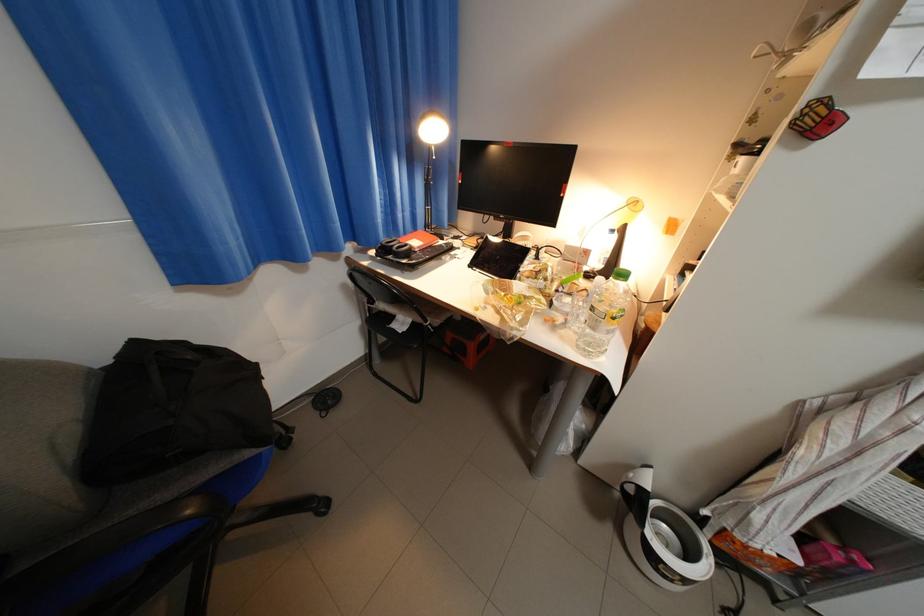
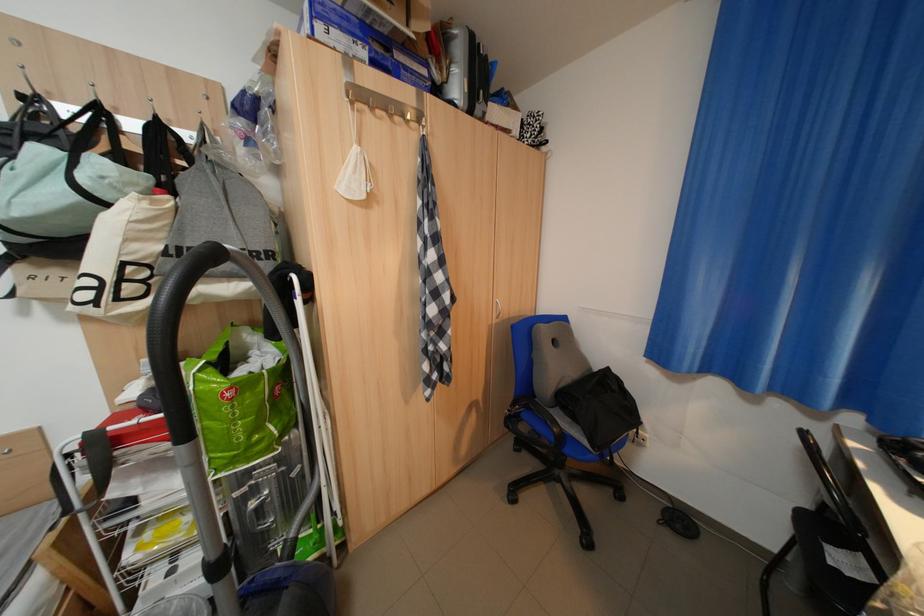
Question: The images are taken continuously from a first-person perspective. In which direction is your viewpoint rotating?

Choices:
 (A) Left
 (B) Right
 (C) Up
 (D) Down

Answer: (A)